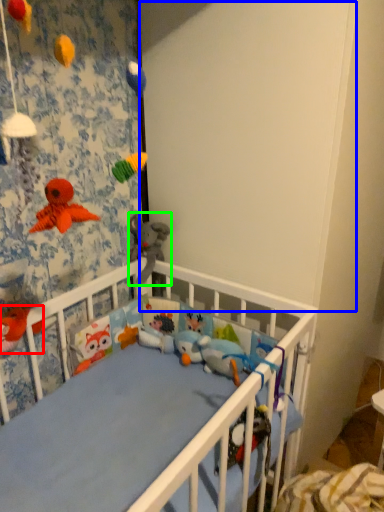
Question: Considering the real-world distances, which object is farthest from toy (highlighted by a red box)? backdrop (highlighted by a blue box) or toy (highlighted by a green box)?

Choices:
 (A) backdrop
 (B) toy

Answer: (A)